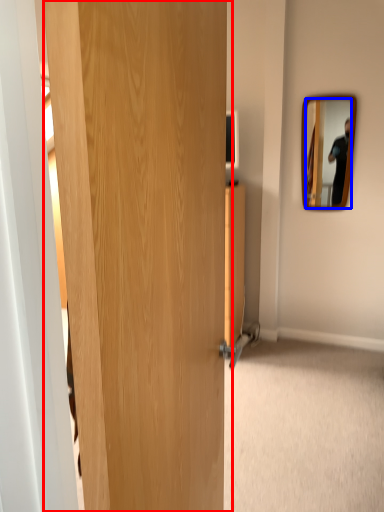
Question: Which of the following is the closest to the observer, door (highlighted by a red box) or mirror (highlighted by a blue box)?

Choices:
 (A) door
 (B) mirror

Answer: (A)